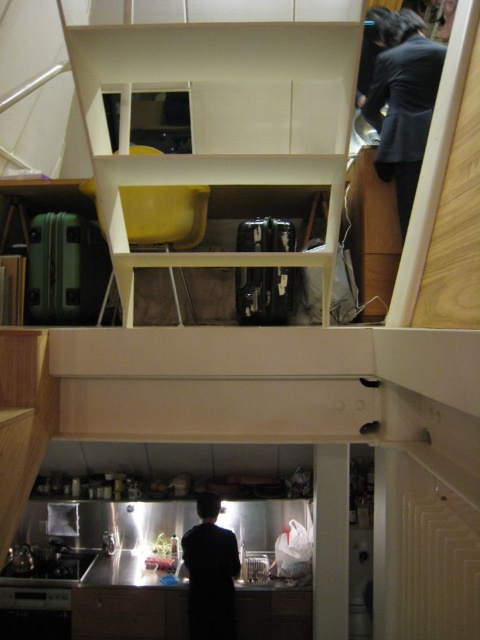
You are a delivery person who needs to place a 3.0 meter long package in this kitchen. The package must be placed between the dark blue suit at upper right and the dark matte shirt at lower center. Is there enough space for the package to fit between them?

The distance between the dark blue suit at upper right and the dark matte shirt at lower center is 2.56 meters. Since the package is 3.0 meters long, it is longer than the available space. Therefore, the package cannot fit between them.

You are a delivery person who needs to place a small package on the countertop in the kitchen. The package must be placed at point (211, 572). However, there is an object already at that location. What is the object blocking the placement of the package?

The dark matte shirt at lower center is located at point (211, 572), so it is blocking the placement of the package.